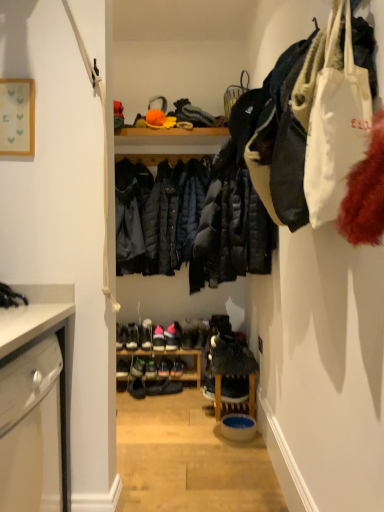
Question: Looking at their shapes, would you say matte black shoe at center, which is the 6th footwear in right-to-left order, is wider or thinner than black leather shoes at center, acting as the fourth footwear starting from the left?

Choices:
 (A) wide
 (B) thin

Answer: (A)

Question: From the image's perspective, is matte black shoe at center, which ranks as the 3th footwear in left-to-right order, located above or below black leather shoes at center, the fifth footwear in the right-to-left sequence?

Choices:
 (A) below
 (B) above

Answer: (B)

Question: Which object is positioned farthest from the shiny black shoe at center, acting as the 2th footwear starting from the right?

Choices:
 (A) shiny black shoe at center, which appears as the fourth footwear when viewed from the right
 (B) matte black shoe at center, which is the 6th footwear in right-to-left order
 (C) pink suede shoes at center, which appears as the 1th footwear when viewed from the left
 (D) shiny black shoe at center, positioned as the seventh footwear in right-to-left order
 (E) black leather shoes at center, the fifth footwear in the right-to-left sequence

Answer: (C)

Question: Considering the real-world distances, which object is farthest from the white suede sneakers at center, the eighth footwear when ordered from left to right?

Choices:
 (A) shiny black shoe at center, the 7th footwear when ordered from left to right
 (B) shiny black shoe at center, positioned as the seventh footwear in right-to-left order
 (C) pink suede shoes at center, which appears as the 1th footwear when viewed from the left
 (D) matte black shoe at center, which ranks as the 3th footwear in left-to-right order
 (E) shiny black shoe at center, which appears as the fourth footwear when viewed from the right

Answer: (C)